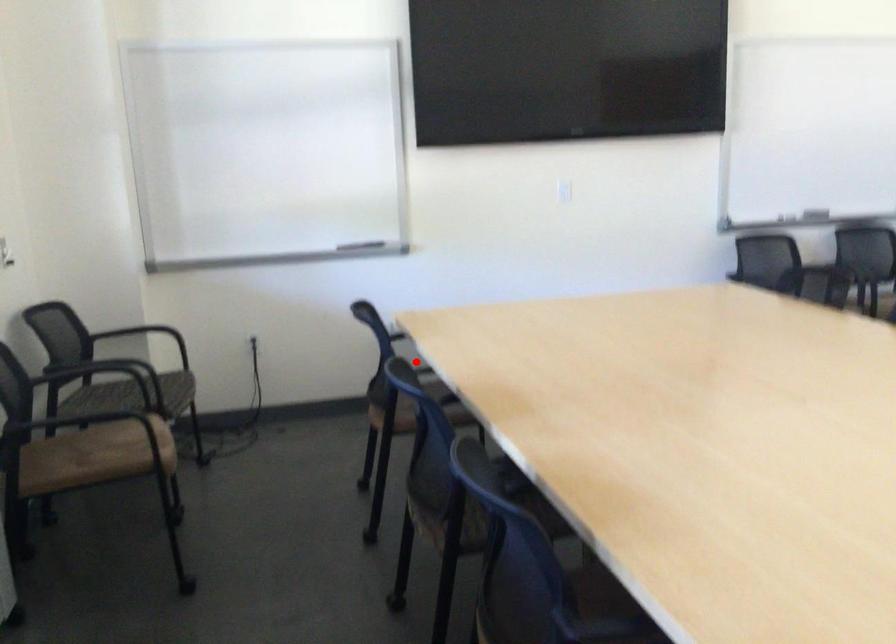
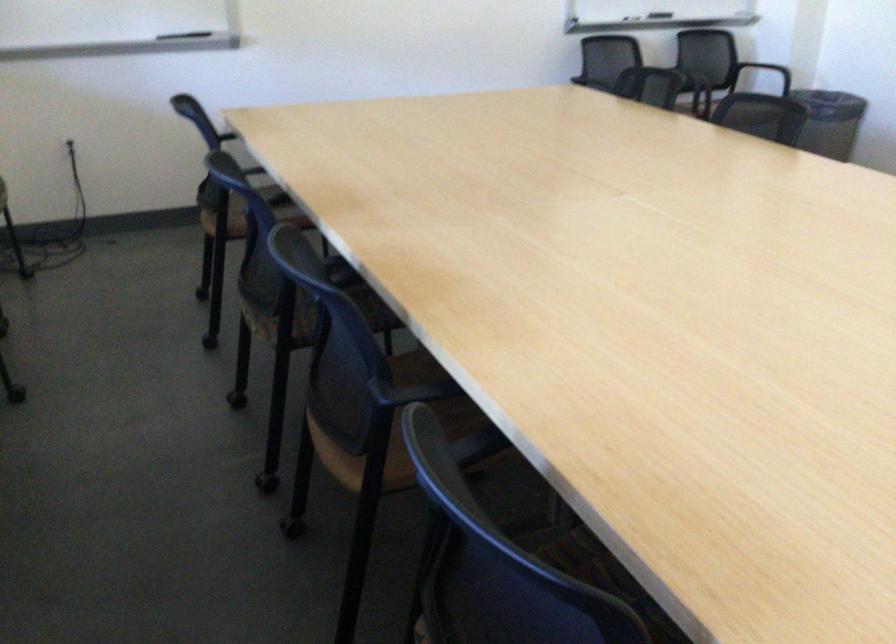
Locate, in the second image, the point that corresponds to the highlighted location in the first image.

(253, 169)